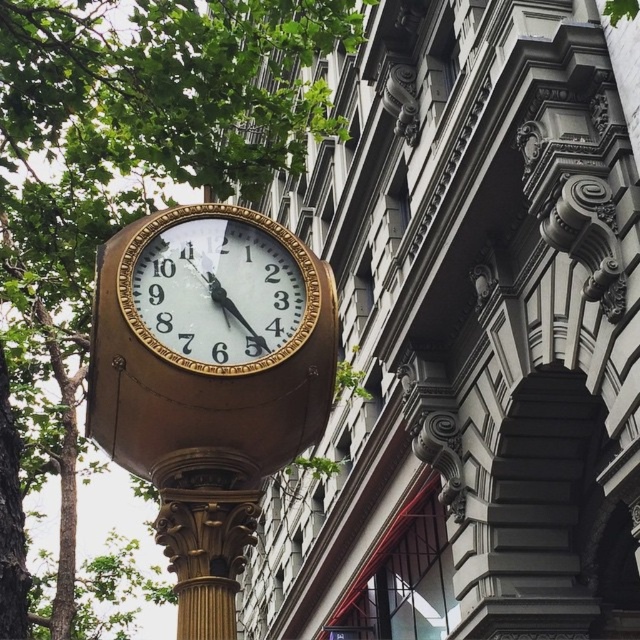
Is point (221, 339) closer to camera compared to point (150, 301)?

Yes.

Is gold polished clock at center wider than gold-bronze clock at center?

Incorrect, gold polished clock at center's width does not surpass gold-bronze clock at center's.

Describe the element at coordinates (209, 342) in the screenshot. I see `gold polished clock at center` at that location.

Image resolution: width=640 pixels, height=640 pixels. I want to click on gold polished clock at center, so click(209, 342).

Can you confirm if green leafy tree at upper left is shorter than gold polished clock at center?

No.

Is green leafy tree at upper left thinner than gold polished clock at center?

No.

The height and width of the screenshot is (640, 640). What do you see at coordinates (145, 116) in the screenshot?
I see `green leafy tree at upper left` at bounding box center [145, 116].

Image resolution: width=640 pixels, height=640 pixels. I want to click on green leafy tree at upper left, so click(145, 116).

How much distance is there between green leafy tree at upper left and gold-bronze clock at center?

green leafy tree at upper left and gold-bronze clock at center are 21.89 meters apart from each other.

Which is in front, point (83, 156) or point (244, 307)?

Positioned in front is point (244, 307).

At what (x,y) coordinates should I click in order to perform the action: click on green leafy tree at upper left. Please return your answer as a coordinate pair (x, y). Looking at the image, I should click on (145, 116).